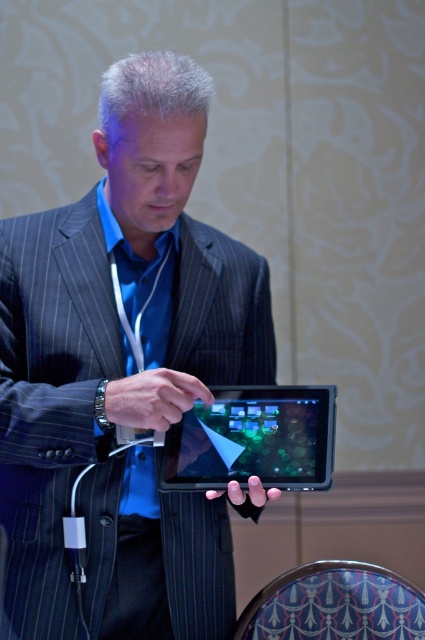
Question: Where is matte black suit at center located in relation to shiny black tablet at center in the image?

Choices:
 (A) below
 (B) above

Answer: (B)

Question: Among these points, which one is nearest to the camera?

Choices:
 (A) (257, 392)
 (B) (108, 170)

Answer: (A)

Question: Observing the image, what is the correct spatial positioning of matte black suit at center in reference to shiny black tablet at center?

Choices:
 (A) above
 (B) below

Answer: (A)

Question: Is matte black suit at center to the left of shiny black tablet at center from the viewer's perspective?

Choices:
 (A) yes
 (B) no

Answer: (A)